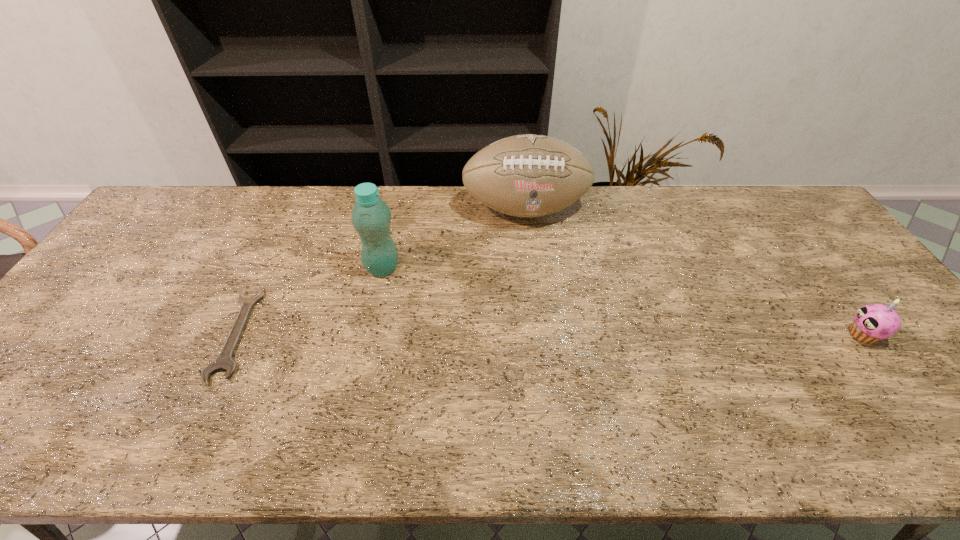
Locate an element on the screen. vacant space located on the face of the third tallest object is located at coordinates (712, 335).

Where is `free space located 0.120m on the face of the third tallest object`? This screenshot has width=960, height=540. free space located 0.120m on the face of the third tallest object is located at coordinates (800, 335).

This screenshot has width=960, height=540. In order to click on free space located 0.290m at the front cap of the water bottle in this screenshot , I will do `click(478, 320)`.

Image resolution: width=960 pixels, height=540 pixels. What are the coordinates of `vacant region located 0.310m at the front cap of the water bottle` in the screenshot? It's located at (484, 323).

What are the coordinates of `vacant space positioned at the front cap of the water bottle` in the screenshot? It's located at (466, 313).

Find the location of a particular element. vacant space located 0.270m on the laces of the farthest object is located at coordinates 546,298.

This screenshot has width=960, height=540. Identify the location of free region located on the laces of the farthest object. (547, 301).

Image resolution: width=960 pixels, height=540 pixels. Find the location of `vacant space located 0.130m on the laces of the farthest object`. vacant space located 0.130m on the laces of the farthest object is located at coordinates (539, 262).

This screenshot has height=540, width=960. Identify the location of object at the far edge. (529, 175).

Find the location of a particular element. The width and height of the screenshot is (960, 540). object situated at the near edge is located at coordinates (224, 362).